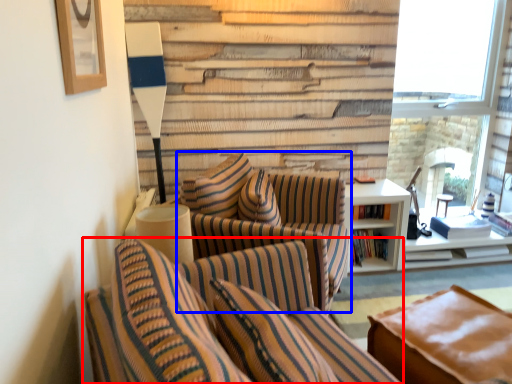
Question: Which point is closer to the camera, chair (highlighted by a red box) or chair (highlighted by a blue box)?

Choices:
 (A) chair
 (B) chair

Answer: (A)